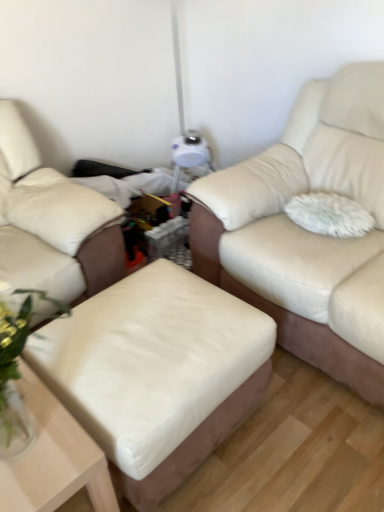
Locate an element on the screen. vacant point above white leather ottoman at center (from a real-world perspective) is located at coordinates coord(154,326).